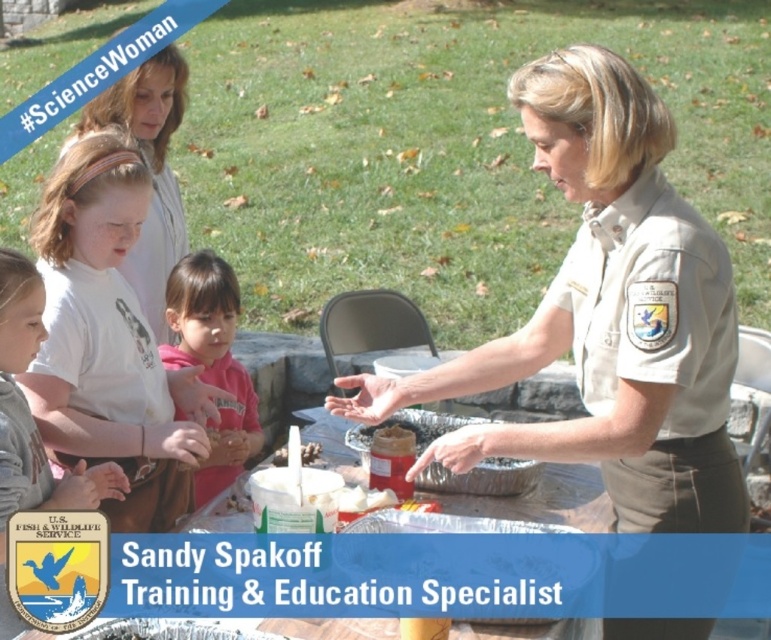
Question: Which of the following is the closest to the observer?

Choices:
 (A) (146, 428)
 (B) (5, 628)

Answer: (B)

Question: Is the position of matte white shirt at upper left less distant than that of matte brown container at center?

Choices:
 (A) no
 (B) yes

Answer: (A)

Question: Which object appears farthest from the camera in this image?

Choices:
 (A) light brown hair at center
 (B) matte white shirt at upper left
 (C) matte white shirt at lower left
 (D) matte brown container at center

Answer: (B)

Question: Does matte white shirt at lower left appear under matte brown container at center?

Choices:
 (A) no
 (B) yes

Answer: (B)

Question: Does pink fleece hoodie at center have a larger size compared to matte brown container at center?

Choices:
 (A) no
 (B) yes

Answer: (B)

Question: Which of these objects is positioned farthest from the light brown hair at center?

Choices:
 (A) matte brown container at center
 (B) matte white shirt at lower left
 (C) satin tan uniform at center

Answer: (C)